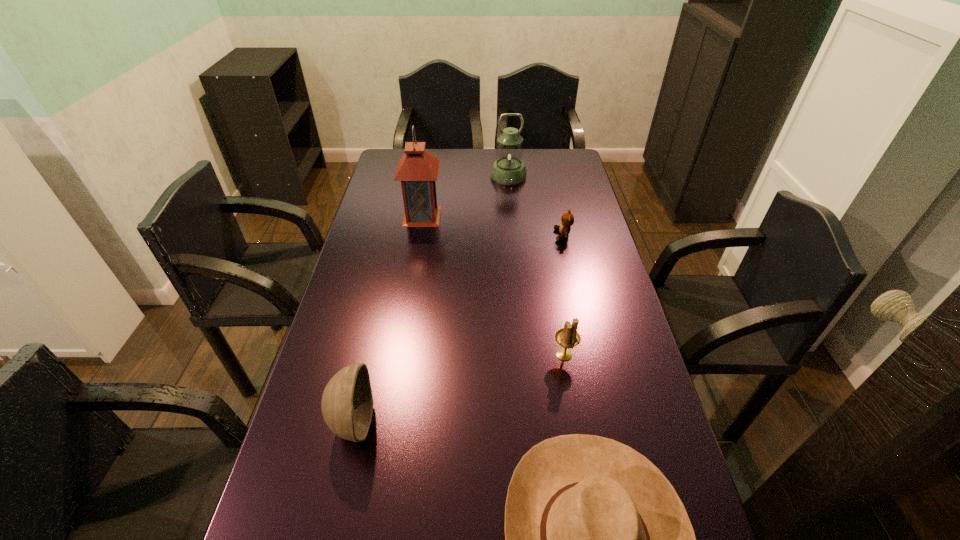
Identify the location of free space located on the back of the bowl. This screenshot has width=960, height=540. (380, 303).

Image resolution: width=960 pixels, height=540 pixels. In order to click on vacant space located 0.300m on the front of the candle holder in this screenshot , I will do `click(588, 487)`.

Find the location of `vacant space located on the front-facing side of the fourth nearest object`. vacant space located on the front-facing side of the fourth nearest object is located at coordinates (467, 235).

Locate an element on the screen. blank area located on the front-facing side of the fourth nearest object is located at coordinates (522, 235).

At what (x,y) coordinates should I click in order to perform the action: click on vacant space situated 0.310m on the front-facing side of the fourth nearest object. Please return your answer as a coordinate pair (x, y). The image size is (960, 540). Looking at the image, I should click on (464, 235).

At what (x,y) coordinates should I click in order to perform the action: click on object that is at the far edge. Please return your answer as a coordinate pair (x, y). Looking at the image, I should click on click(508, 169).

The height and width of the screenshot is (540, 960). What are the coordinates of `lantern present at the left edge` in the screenshot? It's located at (417, 170).

At what (x,y) coordinates should I click in order to perform the action: click on bowl that is at the left edge. Please return your answer as a coordinate pair (x, y). Looking at the image, I should click on (347, 403).

Where is `candle holder positioned at the right edge`? This screenshot has width=960, height=540. candle holder positioned at the right edge is located at coordinates (568, 337).

I want to click on teddy bear that is at the right edge, so click(567, 220).